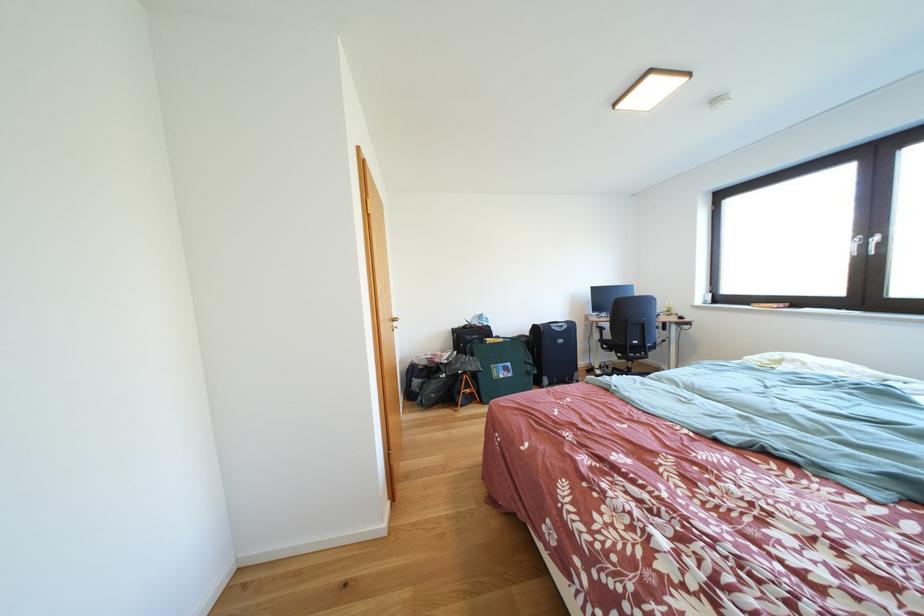
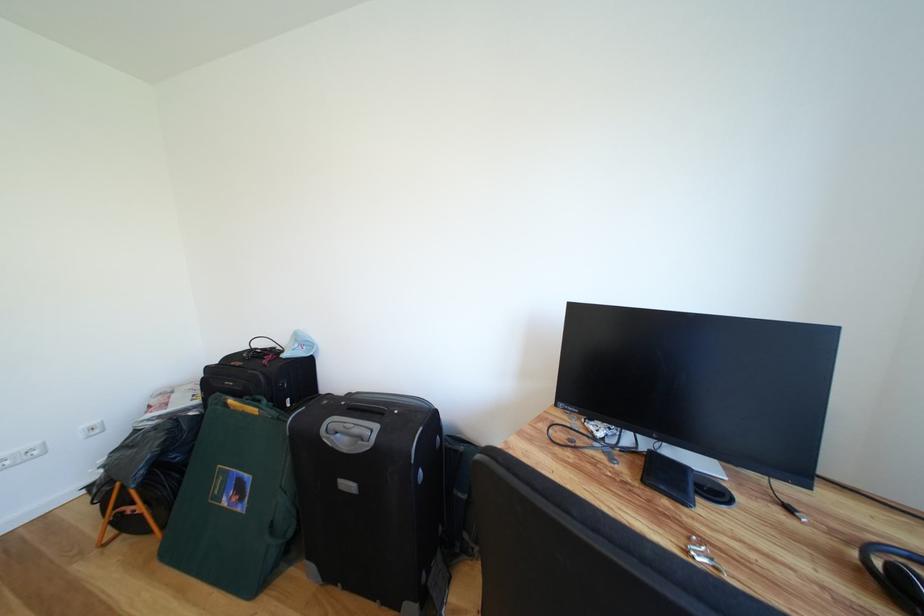
In the second image, find the point that corresponds to the point at 509,381 in the first image.

(234, 506)